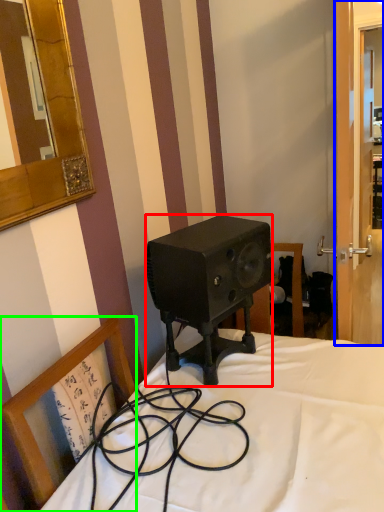
Question: Which object is the farthest from speaker (highlighted by a red box)? Choose among these: screen door (highlighted by a blue box) or chair (highlighted by a green box).

Choices:
 (A) screen door
 (B) chair

Answer: (A)